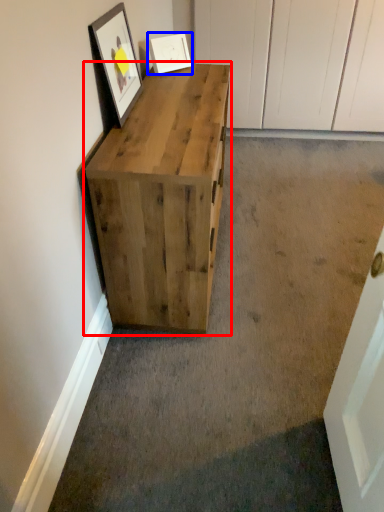
Question: Which of the following is the farthest to the observer, chest of drawers (highlighted by a red box) or picture frame (highlighted by a blue box)?

Choices:
 (A) chest of drawers
 (B) picture frame

Answer: (B)